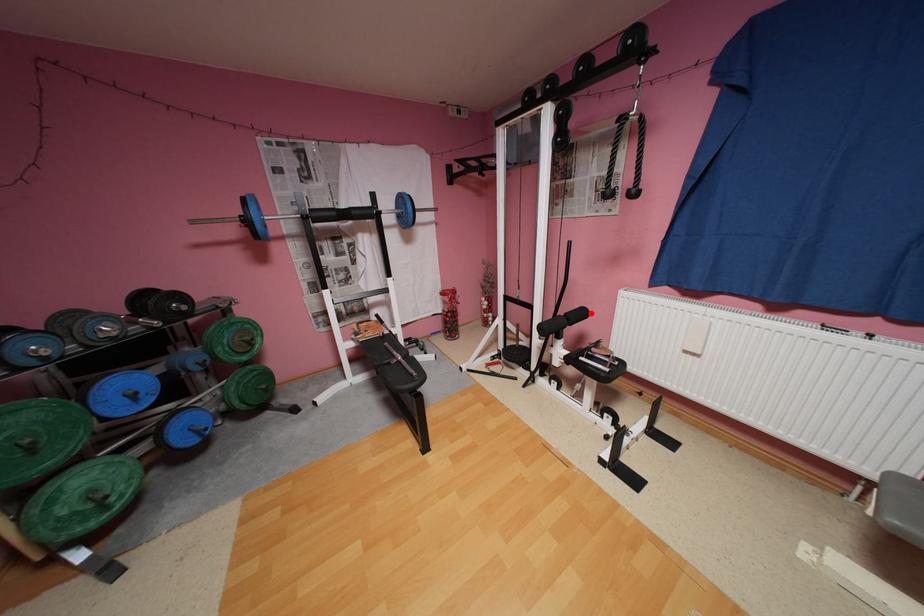
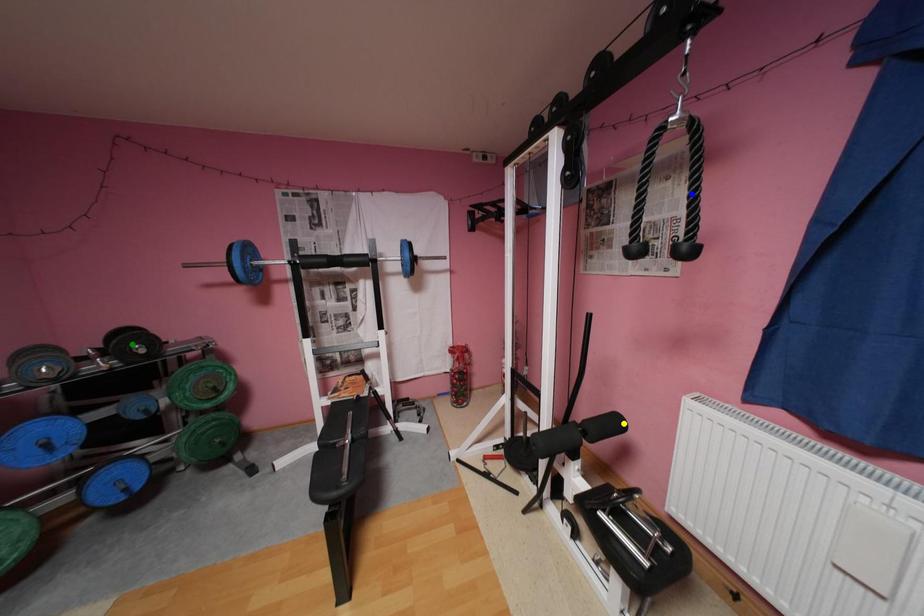
Question: I am providing you with two images of the same scene from different viewpoints. A red point is marked on the first image. You are given multiple points on the second image. Can you choose the point in image 2 that corresponds to the point in image 1?

Choices:
 (A) blue point
 (B) green point
 (C) yellow point

Answer: (C)